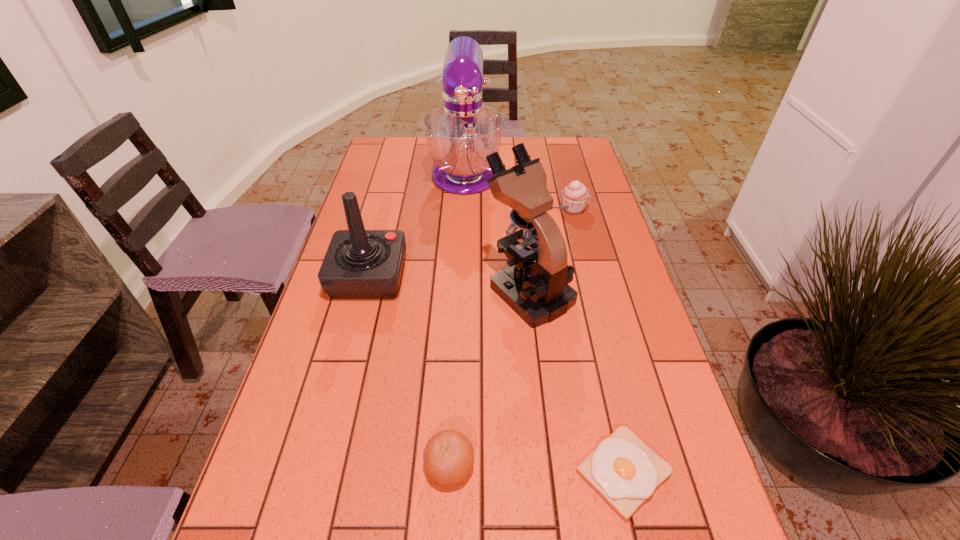
Identify the location of free space located on the left of the fourth tallest object. (542, 209).

At what (x,y) coordinates should I click in order to perform the action: click on vacant space situated on the right of the fifth tallest object. Please return your answer as a coordinate pair (x, y). This screenshot has height=540, width=960. Looking at the image, I should click on [x=658, y=465].

You are a GUI agent. You are given a task and a screenshot of the screen. Output one action in this format:
    pyautogui.click(x=<x>, y=<y>)
    Task: Click on the blank space located on the back of the shortest object
    
    Given the screenshot: What is the action you would take?
    pyautogui.click(x=582, y=292)

Where is `object at the far edge`? This screenshot has width=960, height=540. object at the far edge is located at coordinates (460, 134).

Where is `object that is positioned at the left edge`? The height and width of the screenshot is (540, 960). object that is positioned at the left edge is located at coordinates [x=359, y=264].

You are a GUI agent. You are given a task and a screenshot of the screen. Output one action in this format:
    pyautogui.click(x=<x>, y=<y>)
    Task: Click on the microscope that is at the right edge
    
    Given the screenshot: What is the action you would take?
    pyautogui.click(x=534, y=284)

Find the location of a particular element. cupcake at the right edge is located at coordinates (575, 195).

Find the location of `toast that is positioned at the right edge`. toast that is positioned at the right edge is located at coordinates (624, 471).

In the image, there is a desktop. Where is `vacant space at the left edge`? The width and height of the screenshot is (960, 540). vacant space at the left edge is located at coordinates point(289,492).

What are the coordinates of `free point at the right edge` in the screenshot? It's located at (599, 313).